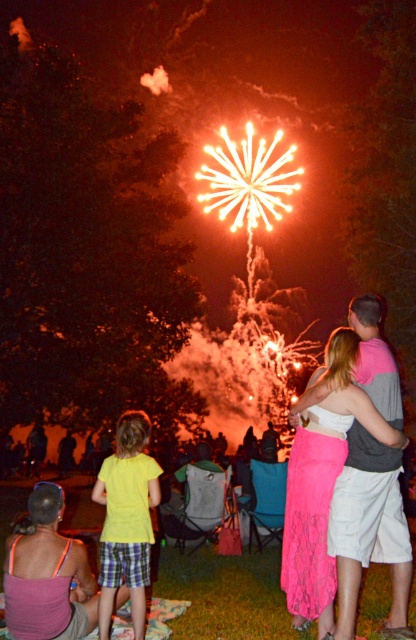
Which is in front, point (113, 566) or point (388, 440)?

Positioned in front is point (388, 440).

Is yellow cotton shirt at lower left taller than pink lace skirt at center?

Indeed, yellow cotton shirt at lower left has a greater height compared to pink lace skirt at center.

Locate an element on the screen. The width and height of the screenshot is (416, 640). yellow cotton shirt at lower left is located at coordinates (126, 518).